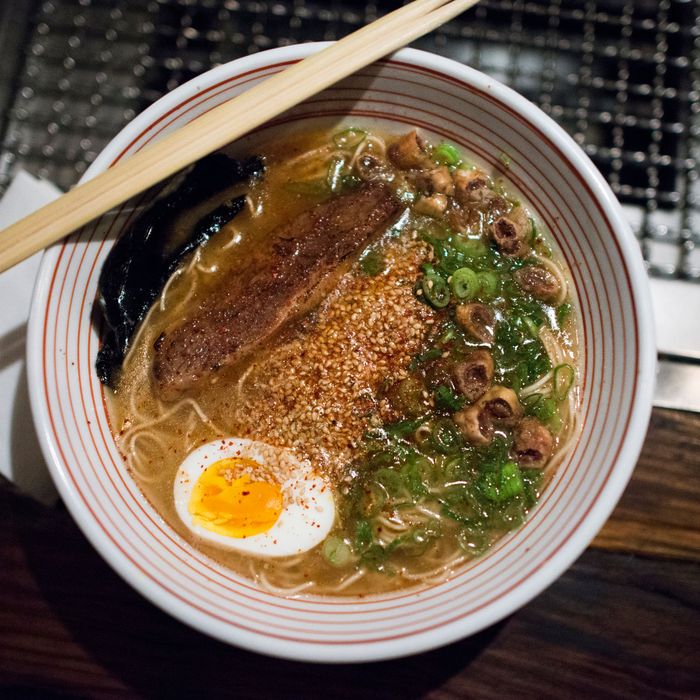
Image resolution: width=700 pixels, height=700 pixels. I want to click on chopsticks, so click(281, 94).